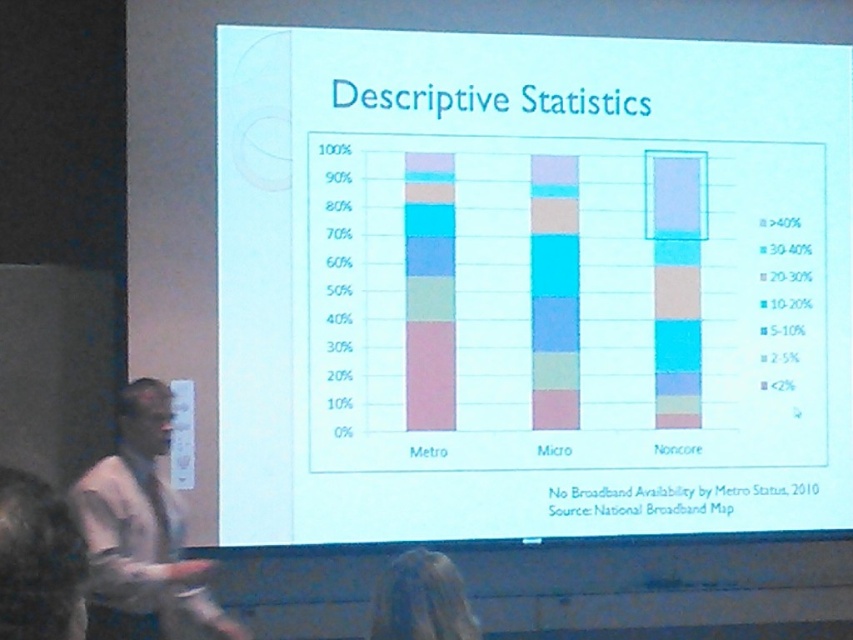
You are standing in front of the presentation slide about Descriptive Statistics. There is a white shirt at left. Where is the white shirt located in terms of coordinates?

The white shirt at left is located at coordinates point (142,536).

Based on the presentation slide about Descriptive Statistics, there is a point at coordinates [531,285]. What object is located at this position?

The point at coordinates [531,285] marks white paper at center.